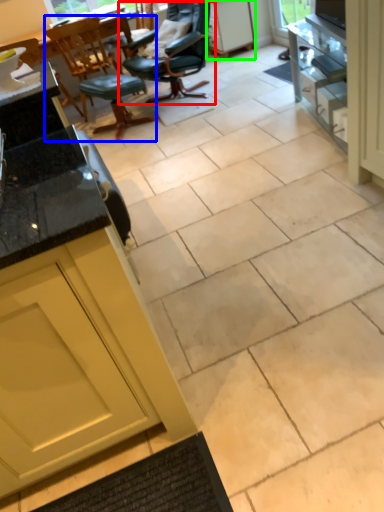
Question: Estimate the real-world distances between objects in this image. Which object is farther from chair (highlighted by a red box), chair (highlighted by a blue box) or cabinetry (highlighted by a green box)?

Choices:
 (A) chair
 (B) cabinetry

Answer: (B)